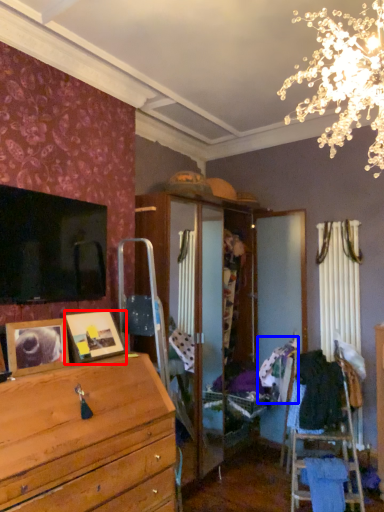
Question: Which point is closer to the camera, picture frame (highlighted by a red box) or clothing (highlighted by a blue box)?

Choices:
 (A) picture frame
 (B) clothing

Answer: (A)